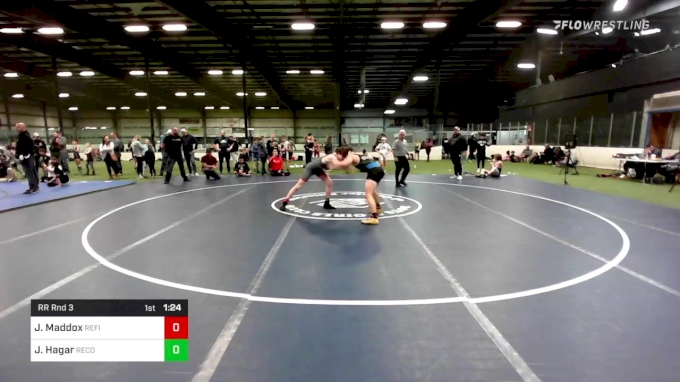
Where is `table`? Image resolution: width=680 pixels, height=382 pixels. table is located at coordinates (653, 160).